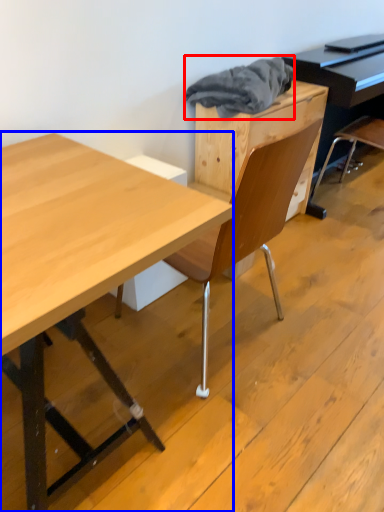
Question: Which of the following is the closest to the observer, material (highlighted by a red box) or desk (highlighted by a blue box)?

Choices:
 (A) material
 (B) desk

Answer: (B)